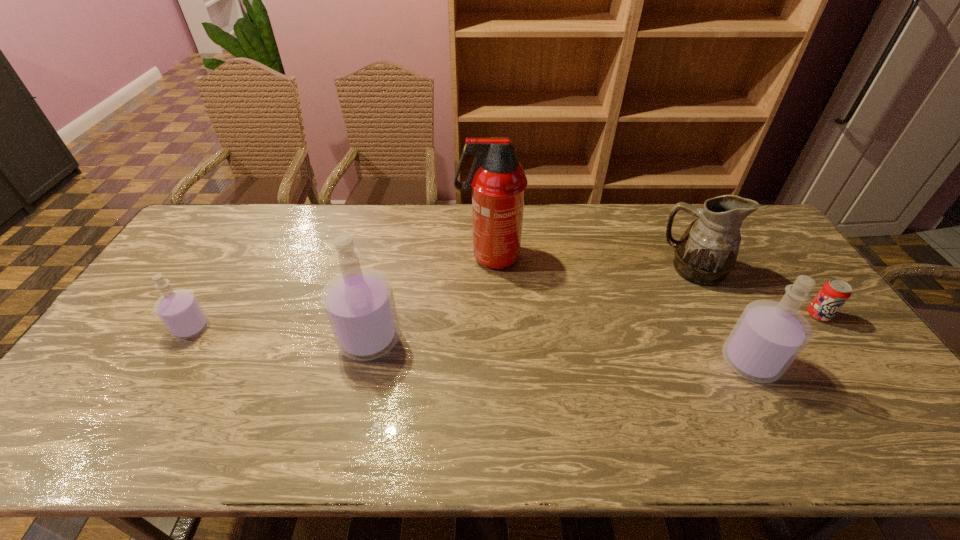
The width and height of the screenshot is (960, 540). Identify the location of free space located 0.320m on the left of the rightmost perfume. (599, 362).

Identify the location of blank area located 0.380m from the spout of the pitcher. (543, 269).

Locate an element on the screen. The width and height of the screenshot is (960, 540). free space located 0.320m from the spout of the pitcher is located at coordinates (562, 269).

Identify the location of free space located 0.190m from the spout of the pitcher. This screenshot has height=540, width=960. (603, 269).

Where is `free space located on the trigger side of the fire extinguisher`? This screenshot has height=540, width=960. free space located on the trigger side of the fire extinguisher is located at coordinates (x=363, y=256).

Locate an element on the screen. free region located 0.290m on the trigger side of the fire extinguisher is located at coordinates (370, 256).

Where is `vacant area located 0.100m on the trigger side of the fire extinguisher`? The height and width of the screenshot is (540, 960). vacant area located 0.100m on the trigger side of the fire extinguisher is located at coordinates (427, 256).

Find the location of `free space located 0.230m on the surface of the soda can`. free space located 0.230m on the surface of the soda can is located at coordinates (877, 396).

Locate an element on the screen. object that is at the far edge is located at coordinates (497, 180).

Locate an element on the screen. The width and height of the screenshot is (960, 540). object present at the near edge is located at coordinates (769, 335).